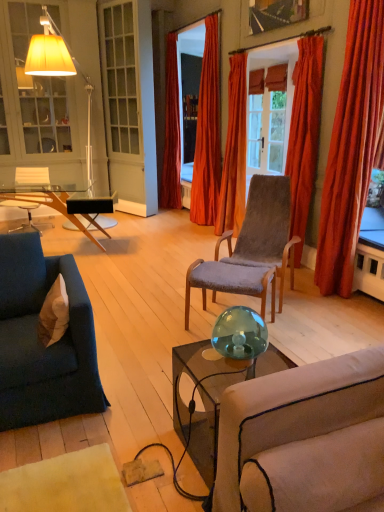
Question: In the image, is velvet blue couch at left positioned in front of or behind white fabric pillow at lower left?

Choices:
 (A) behind
 (B) front

Answer: (B)

Question: From the image's perspective, is velvet blue couch at left positioned above or below white fabric pillow at lower left?

Choices:
 (A) below
 (B) above

Answer: (A)

Question: Which of these objects is positioned closest to the velvet blue couch at left?

Choices:
 (A) transparent glass coffee table at left
 (B) velvet orange curtain at center, the fifth curtain viewed from the right
 (C) velvet orange curtain at center, which appears as the third curtain when viewed from the left
 (D) matte glass window screen at upper right
 (E) transparent glass chair at left, the 2th chair viewed from the right

Answer: (A)

Question: Estimate the real-world distances between objects in this image. Which object is farther from the clear glass door at center?

Choices:
 (A) white fabric pillow at lower left
 (B) velvet grey chair at center, arranged as the second chair when viewed from the left
 (C) velvet orange curtain at center, which is the 1th curtain from left to right
 (D) transparent glass chair at left, which is the 1th chair in back-to-front order
 (E) wooden picture frame at upper center

Answer: (A)